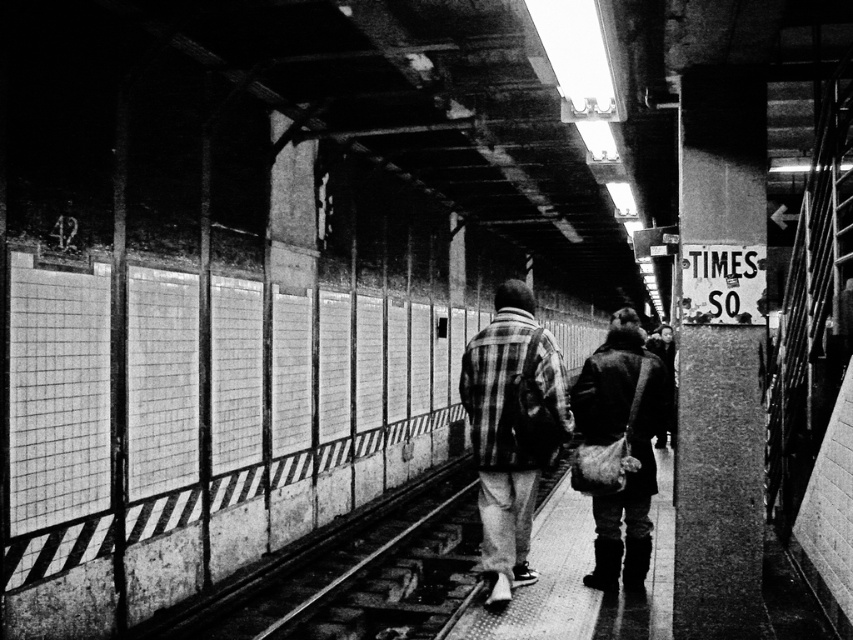
Describe the element at coordinates (511, 429) in the screenshot. I see `plaid fabric jacket at center` at that location.

Is point (473, 349) farther from camera compared to point (650, 538)?

No, (473, 349) is closer to viewer.

Which is behind, point (506, 596) or point (619, 321)?

The point (619, 321) is behind.

Where is `plaid fabric jacket at center`? Image resolution: width=853 pixels, height=640 pixels. plaid fabric jacket at center is located at coordinates (511, 429).